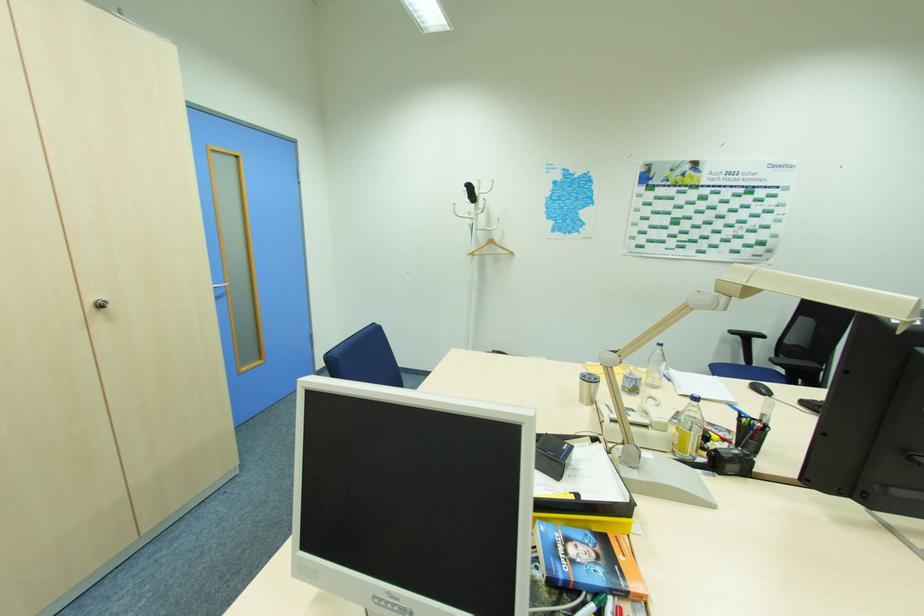
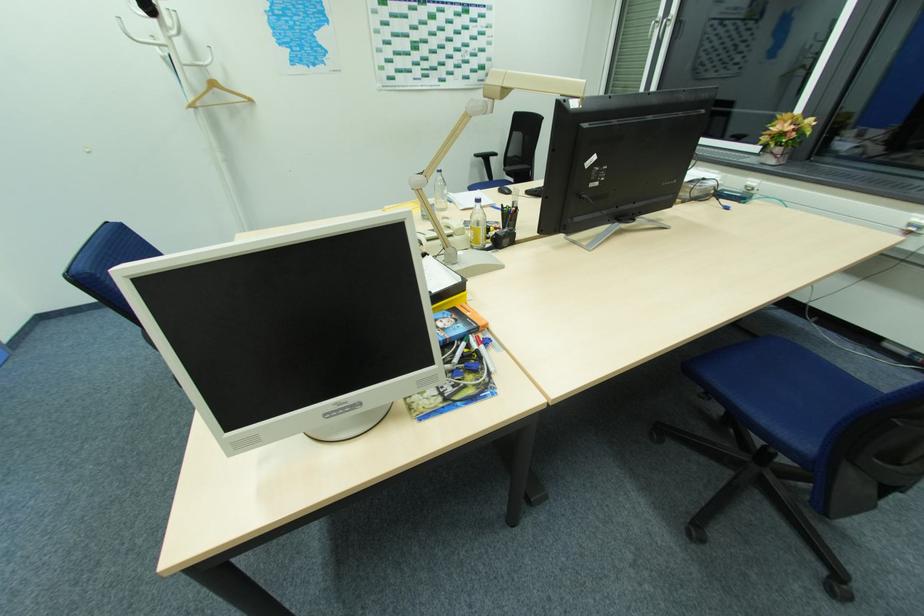
First-person continuous shooting, in which direction is the camera rotating?

The rotation direction of the camera is right-down.